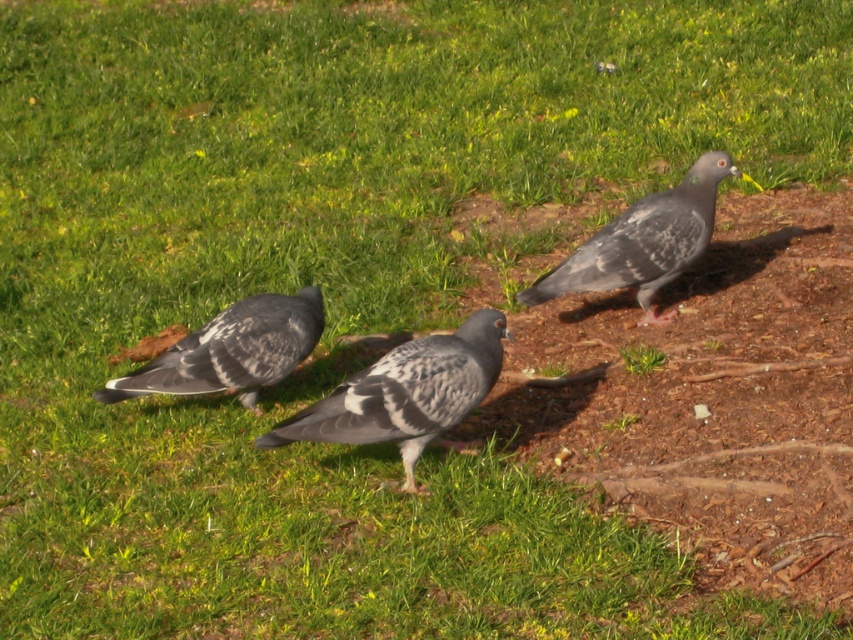
You are a photographer aiming to capture the speckled feather pigeon at center and the gray speckled pigeon at lower left in a single frame. Based on their positions, which pigeon is positioned lower in the image?

The speckled feather pigeon at center is positioned lower than the gray speckled pigeon at lower left.

You are a photographer aiming to capture a closeup of the speckled feather pigeon at center and the speckled gray pigeon at center. Given that your camera can focus on objects within a 4 feet range, will you be able to capture both pigeons in a single focused shot?

The speckled feather pigeon at center and the speckled gray pigeon at center are 4.27 feet apart. Since the distance between them exceeds the camera focus range of 4 feet, you cannot capture both in a single focused shot.